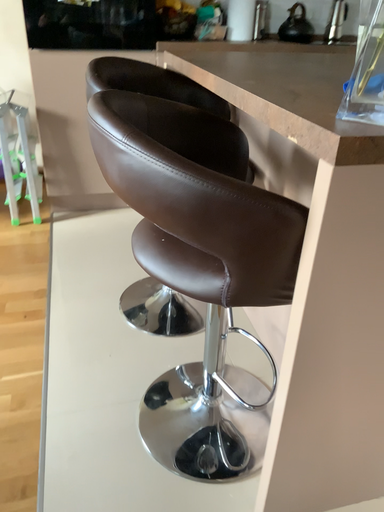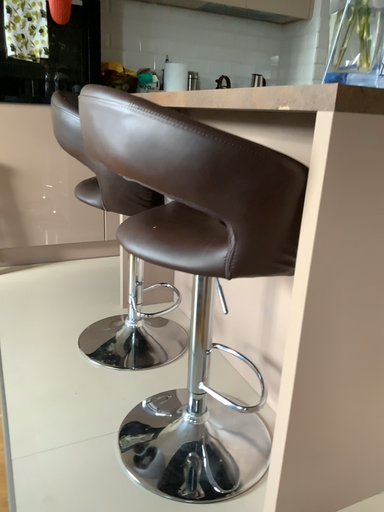
Question: Which way did the camera rotate in the video?

Choices:
 (A) rotated upward
 (B) rotated downward

Answer: (A)